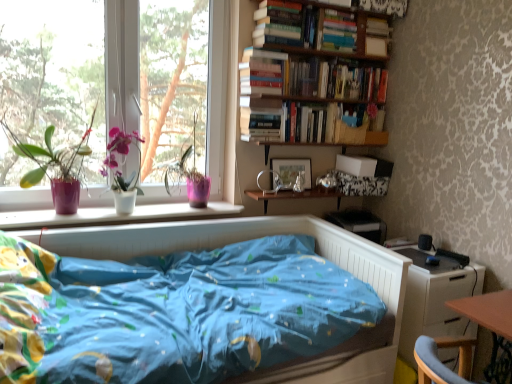
What do you see at coordinates (114, 215) in the screenshot?
I see `pink matte window sill at lower left` at bounding box center [114, 215].

Measure the distance between pink matte window sill at lower left and camera.

pink matte window sill at lower left and camera are 6.59 feet apart from each other.

The image size is (512, 384). What do you see at coordinates (54, 73) in the screenshot?
I see `transparent glass window at left, marked as the first window screen in a left-to-right arrangement` at bounding box center [54, 73].

You are a GUI agent. You are given a task and a screenshot of the screen. Output one action in this format:
    pyautogui.click(x=<x>, y=<y>)
    Task: Click on the wooden bookshelf at upper center, which is the second shelf from bottom to top
    This screenshot has height=384, width=512.
    Given the screenshot: What is the action you would take?
    pyautogui.click(x=374, y=35)

Where is `pink matte window sill at lower left`? Image resolution: width=512 pixels, height=384 pixels. pink matte window sill at lower left is located at coordinates (114, 215).

Considering the relative positions of transparent glass window at upper left and white glossy dresser at lower right in the image provided, is transparent glass window at upper left to the left of white glossy dresser at lower right from the viewer's perspective?

Yes.

Consider the image. Is transparent glass window at upper left turned away from white glossy dresser at lower right?

No, white glossy dresser at lower right is not at the back of transparent glass window at upper left.

From the image's perspective, which is above, transparent glass window at upper left or white glossy dresser at lower right?

From the image's view, transparent glass window at upper left is above.

From the image's perspective, does white glossy vase at left, which is counted as the 1th window screen, starting from the right, appear higher than matte purple pot at left?

Yes, from the image's perspective, white glossy vase at left, which is counted as the 1th window screen, starting from the right, is over matte purple pot at left.

Is white glossy vase at left, which is counted as the 1th window screen, starting from the right, aimed at matte purple pot at left?

No, white glossy vase at left, which is counted as the 1th window screen, starting from the right, is not facing towards matte purple pot at left.

Does white glossy vase at left, which is counted as the 1th window screen, starting from the right, have a lesser height compared to matte purple pot at left?

No.

Measure the distance between hardcover books at upper right, the 1th book in the top-to-bottom sequence, and matte purple pot at left.

The distance of hardcover books at upper right, the 1th book in the top-to-bottom sequence, from matte purple pot at left is 4.45 feet.

Does hardcover books at upper right, the 1th book in the top-to-bottom sequence, turn towards matte purple pot at left?

No, hardcover books at upper right, the 1th book in the top-to-bottom sequence, is not oriented towards matte purple pot at left.

Considering the relative positions of hardcover books at upper right, positioned as the 3th book in bottom-to-top order, and matte purple pot at left in the image provided, is hardcover books at upper right, positioned as the 3th book in bottom-to-top order, in front of matte purple pot at left?

No, hardcover books at upper right, positioned as the 3th book in bottom-to-top order, is further to the viewer.

Considering the points (318, 190) and (390, 30), which point is behind, point (318, 190) or point (390, 30)?

Point (318, 190)

In terms of height, does wooden shelf at center, which is the first shelf in bottom-to-top order, look taller or shorter compared to wooden bookshelf at upper center, which is the second shelf from bottom to top?

In the image, wooden shelf at center, which is the first shelf in bottom-to-top order, appears to be shorter than wooden bookshelf at upper center, which is the second shelf from bottom to top.

From a real-world perspective, which is physically below, wooden shelf at center, which is the 2th shelf in top-to-bottom order, or wooden bookshelf at upper center, which is the second shelf from bottom to top?

From a 3D spatial view, wooden shelf at center, which is the 2th shelf in top-to-bottom order, is below.

Who is bigger, wooden shelf at center, which is the 2th shelf in top-to-bottom order, or wooden bookshelf at upper center, which is the second shelf from bottom to top?

wooden shelf at center, which is the 2th shelf in top-to-bottom order, is bigger.

From a real-world perspective, which object rests below the other?

wooden shelf at center, which is the first shelf in bottom-to-top order, is physically lower.

Is hardcover book at upper right, which is the 2th book in bottom-to-top order, positioned far away from wooden shelf at center, which is the 2th shelf in top-to-bottom order?

No.

Does point (355, 45) lie behind point (263, 203)?

No, it is in front of (263, 203).

At what (x,y) coordinates should I click in order to perform the action: click on shelf located below the hardcover book at upper right, which is the 2th book in bottom-to-top order (from the image's perspective). Please return your answer as a coordinate pair (x, y). Looking at the image, I should click on (293, 196).

From the image's perspective, relative to matte white pot at window, is pink matte window sill at lower left above or below?

pink matte window sill at lower left is situated lower than matte white pot at window in the image.

Identify the location of flower on the left of pink matte window sill at lower left. (118, 149).

Considering the relative sizes of pink matte window sill at lower left and matte white pot at window in the image provided, is pink matte window sill at lower left wider than matte white pot at window?

Yes, pink matte window sill at lower left is wider than matte white pot at window.

Which is nearer, (6, 228) or (104, 172)?

Point (6, 228) is closer to the camera than point (104, 172).

What's the angular difference between matte purple pot at left and transparent glass window at left, marked as the first window screen in a left-to-right arrangement,'s facing directions?

matte purple pot at left and transparent glass window at left, marked as the first window screen in a left-to-right arrangement, are facing 1.49 degrees away from each other.

Is matte purple pot at left outside of transparent glass window at left, which ranks as the 2th window screen in right-to-left order?

Yes, matte purple pot at left is outside of transparent glass window at left, which ranks as the 2th window screen in right-to-left order.

From the image's perspective, is matte purple pot at left over transparent glass window at left, marked as the first window screen in a left-to-right arrangement?

Incorrect, from the image's perspective, matte purple pot at left is lower than transparent glass window at left, marked as the first window screen in a left-to-right arrangement.

Consider the image. Is matte purple pot at left behind transparent glass window at left, marked as the first window screen in a left-to-right arrangement?

That is False.

You are a GUI agent. You are given a task and a screenshot of the screen. Output one action in this format:
    pyautogui.click(x=<x>, y=<y>)
    Task: Click on the window above the white glossy dresser at lower right (from a real-world perspective)
    Image resolution: width=512 pixels, height=384 pixels.
    Given the screenshot: What is the action you would take?
    pyautogui.click(x=142, y=135)

This screenshot has width=512, height=384. Find the location of `houseplant in front of the white glossy vase at left, which is counted as the 1th window screen, starting from the right`. houseplant in front of the white glossy vase at left, which is counted as the 1th window screen, starting from the right is located at coordinates (56, 166).

Considering their positions, is transparent glass window at left, marked as the first window screen in a left-to-right arrangement, positioned further to pink matte window sill at lower left than matte purple pot at left?

Based on the image, transparent glass window at left, marked as the first window screen in a left-to-right arrangement, appears to be further to pink matte window sill at lower left.

Estimate the real-world distances between objects in this image. Which object is closer to transparent glass window at left, which ranks as the 2th window screen in right-to-left order, white glossy vase at left, which is counted as the 1th window screen, starting from the right, or white glossy dresser at lower right?

Based on the image, white glossy vase at left, which is counted as the 1th window screen, starting from the right, appears to be nearer to transparent glass window at left, which ranks as the 2th window screen in right-to-left order.

From the image, which object appears to be farther from wooden shelf at center, which is the 2th shelf in top-to-bottom order, hardcover book at upper right, which appears as the 2th book when viewed from the top, or blue fabric bed at center?

hardcover book at upper right, which appears as the 2th book when viewed from the top, is further to wooden shelf at center, which is the 2th shelf in top-to-bottom order.

Based on their spatial positions, is matte wooden picture frame at center or transparent glass window at left, which ranks as the 2th window screen in right-to-left order, further from matte purple pot at left?

matte wooden picture frame at center is further to matte purple pot at left.

Estimate the real-world distances between objects in this image. Which object is further from transparent glass window at upper left, wooden shelf at center, which is the 2th shelf in top-to-bottom order, or blue fabric bed at center?

wooden shelf at center, which is the 2th shelf in top-to-bottom order, is positioned further to the anchor transparent glass window at upper left.

Looking at the image, which one is located further to matte wooden picture frame at center, white glossy dresser at lower right or hardcover book at upper right, which appears as the 2th book when viewed from the top?

white glossy dresser at lower right is further to matte wooden picture frame at center.

From the image, which object appears to be farther from wooden bookshelf at upper center, which is the second shelf from bottom to top, hardcover books at upper right, positioned as the 3th book in bottom-to-top order, or pink plastic pot at window?

pink plastic pot at window lies further to wooden bookshelf at upper center, which is the second shelf from bottom to top, than the other object.

Estimate the real-world distances between objects in this image. Which object is further from wooden shelf at center, which is the first shelf in bottom-to-top order, matte purple pot at left or matte wooden picture frame at center?

matte purple pot at left is further to wooden shelf at center, which is the first shelf in bottom-to-top order.

Where is `picture frame located between matte purple pot at left and white glossy dresser at lower right in the left-right direction`? picture frame located between matte purple pot at left and white glossy dresser at lower right in the left-right direction is located at coordinates tap(292, 171).

The image size is (512, 384). Find the location of `window between hardcover book at upper right, which is the 2th book in bottom-to-top order, and blue fabric bed at center in the up-down direction`. window between hardcover book at upper right, which is the 2th book in bottom-to-top order, and blue fabric bed at center in the up-down direction is located at coordinates (142, 135).

Identify the location of flower between transparent glass window at upper left and white glossy dresser at lower right. The height and width of the screenshot is (384, 512). (118, 149).

Locate an element on the screen. The image size is (512, 384). picture frame between hardcover books at upper right, positioned as the 3th book in bottom-to-top order, and wooden shelf at center, which is the first shelf in bottom-to-top order, from top to bottom is located at coordinates (292, 171).